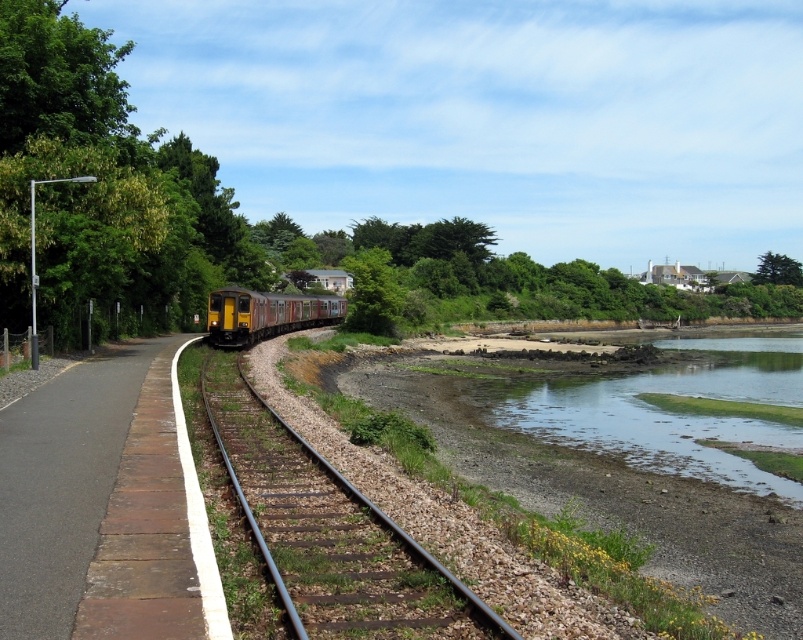
You are standing at the point with coordinates (329,531). Based on the scene description, what object are you currently on?

The point at coordinates (329,531) is located on the metallic brown train track at center.

Consider the image. You are a photographer wanting to capture both the yellow metallic train at center and the green leafy tree at upper right in a single frame. Based on their sizes, which object should you focus on first to ensure both are in the shot?

The yellow metallic train at center is shorter than the green leafy tree at upper right, so you should focus on the green leafy tree at upper right first to ensure both are in the shot.